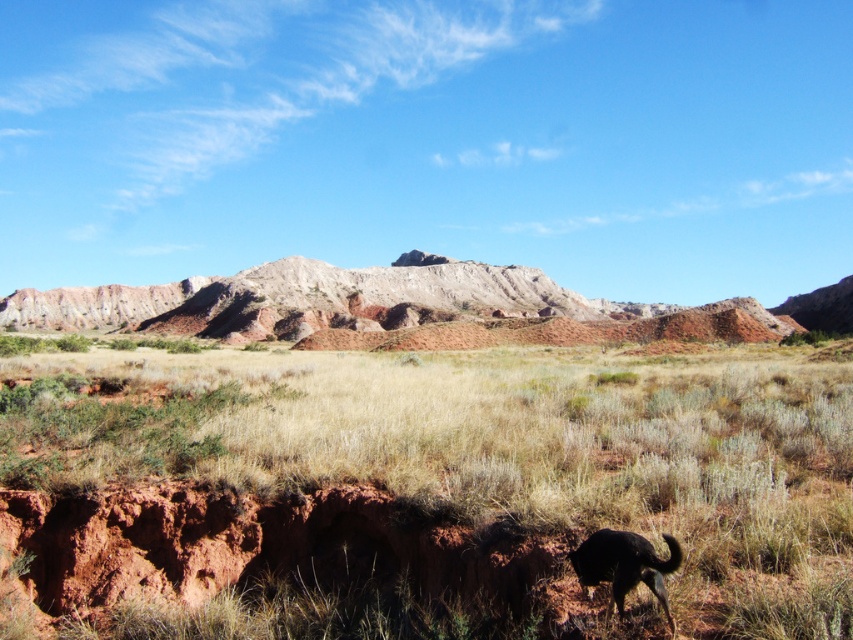
You are a hiker who wants to take a photo of the black fur dog at lower right without the brown dirt at center in the background. Which direction should you move to achieve this?

The brown dirt at center is to the left of the black fur dog at lower right. To avoid having the brown dirt at center in the background, you should move to the right side of the black fur dog at lower right.

You are a hiker who wants to take a photo of the rustic sandstone mountain at center and the black fur dog at lower right in the same frame. Based on their sizes, which object should you focus on first to ensure both are clearly visible in the photo?

The rustic sandstone mountain at center is larger than the black fur dog at lower right, so you should focus on the rustic sandstone mountain at center first to ensure both are clearly visible in the photo.

You are a hiker who wants to take a photo of the brown dirt at center and the black fur dog at lower right. Which object should you focus on first if you want to capture both in a single frame without moving the camera?

You should focus on the brown dirt at center first because it is positioned over the black fur dog at lower right, meaning it is closer to the camera and will be in focus first.